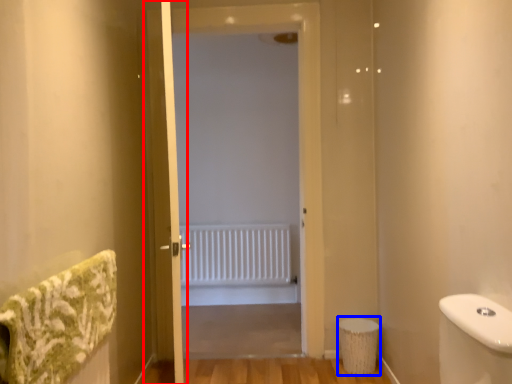
Question: Which object appears farthest to the camera in this image, screen door (highlighted by a red box) or toilet bowl (highlighted by a blue box)?

Choices:
 (A) screen door
 (B) toilet bowl

Answer: (B)